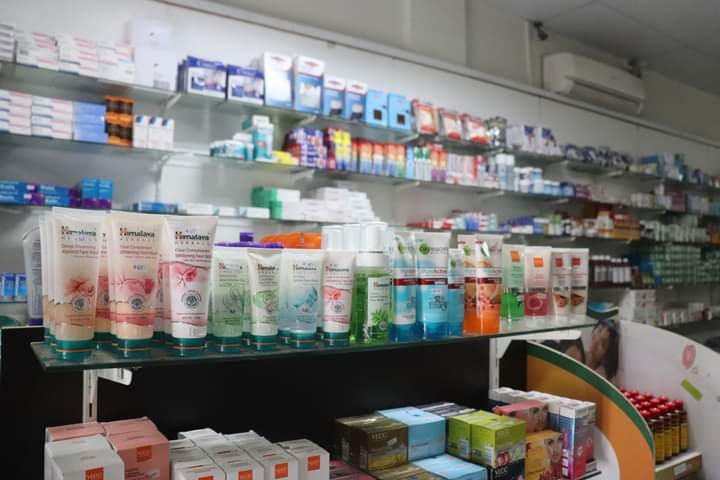
Locate an element on the screen. shelf is located at coordinates (63, 362).